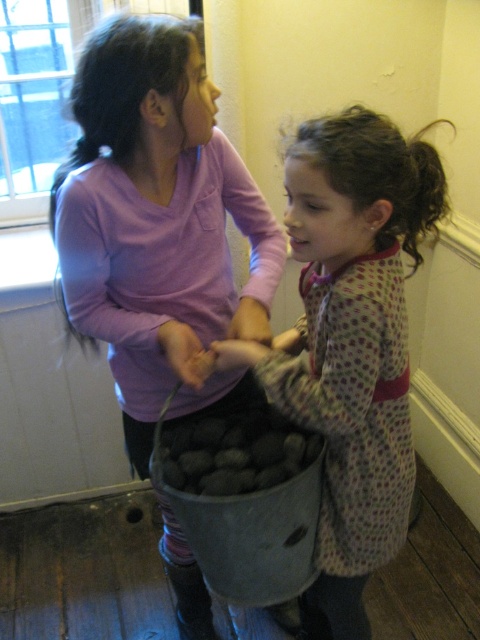
Can you confirm if metallic gray bucket at center is positioned below dark gray stone at center?

Correct, metallic gray bucket at center is located below dark gray stone at center.

Is metallic gray bucket at center behind dark gray stone at center?

No, it is not.

Describe the element at coordinates (250, 532) in the screenshot. I see `metallic gray bucket at center` at that location.

Locate an element on the screen. Image resolution: width=480 pixels, height=640 pixels. metallic gray bucket at center is located at coordinates (250, 532).

Consider the image. Can you confirm if matte pink shirt at center is smaller than metallic bucket of rocks at center?

Incorrect, matte pink shirt at center is not smaller in size than metallic bucket of rocks at center.

Looking at this image, is matte pink shirt at center positioned before metallic bucket of rocks at center?

That is False.

Is point (145, 179) positioned before point (316, 340)?

No, (145, 179) is behind (316, 340).

At what (x,y) coordinates should I click in order to perform the action: click on matte pink shirt at center. Please return your answer as a coordinate pair (x, y). The width and height of the screenshot is (480, 640). Looking at the image, I should click on (157, 225).

Who is taller, metallic bucket of rocks at center or metallic gray bucket at center?

With more height is metallic bucket of rocks at center.

At what (x,y) coordinates should I click in order to perform the action: click on metallic bucket of rocks at center. Please return your answer as a coordinate pair (x, y). The image size is (480, 640). Looking at the image, I should click on (351, 340).

Who is more distant from viewer, (313, 628) or (190, 518)?

Positioned behind is point (313, 628).

Identify the location of metallic bucket of rocks at center. (351, 340).